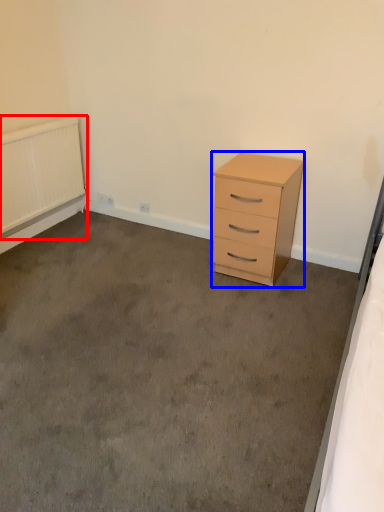
Question: Among these objects, which one is farthest to the camera, radiator (highlighted by a red box) or chest of drawers (highlighted by a blue box)?

Choices:
 (A) radiator
 (B) chest of drawers

Answer: (A)